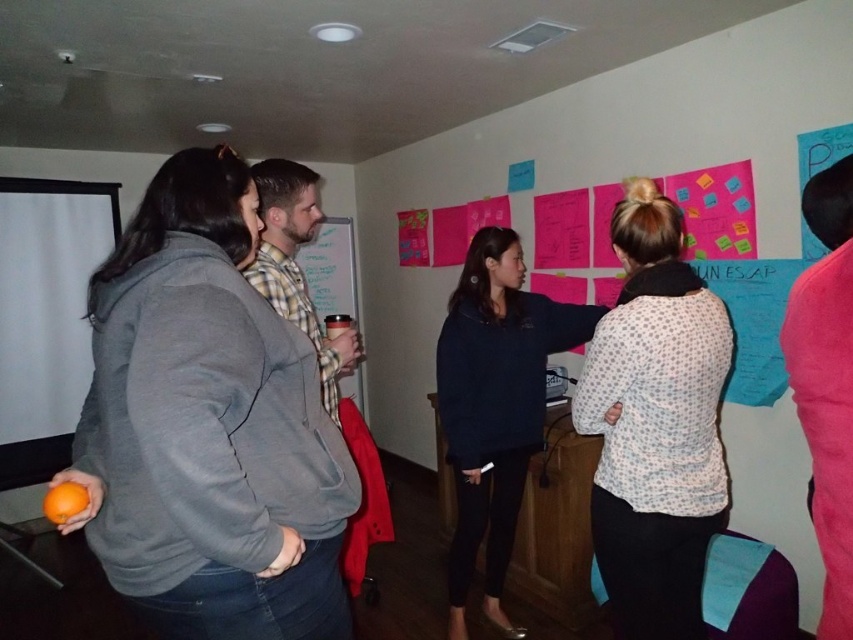
Question: Can you confirm if dark blue sweater at center is wider than plaid fabric shirt at center?

Choices:
 (A) no
 (B) yes

Answer: (B)

Question: Which point appears farthest from the camera in this image?

Choices:
 (A) (329, 337)
 (B) (331, 340)
 (C) (178, 512)

Answer: (A)

Question: Which point is farther to the camera?

Choices:
 (A) (53, 499)
 (B) (672, 371)

Answer: (B)

Question: Considering the relative positions of dark blue sweater at center and orange matte at lower left in the image provided, where is dark blue sweater at center located with respect to orange matte at lower left?

Choices:
 (A) above
 (B) below

Answer: (B)

Question: Which of the following is the closest to the observer?

Choices:
 (A) (631, 586)
 (B) (154, 275)
 (C) (271, 276)
 (D) (343, 324)

Answer: (B)

Question: Does white dotted shirt at center appear on the left side of plaid fabric shirt at center?

Choices:
 (A) yes
 (B) no

Answer: (B)